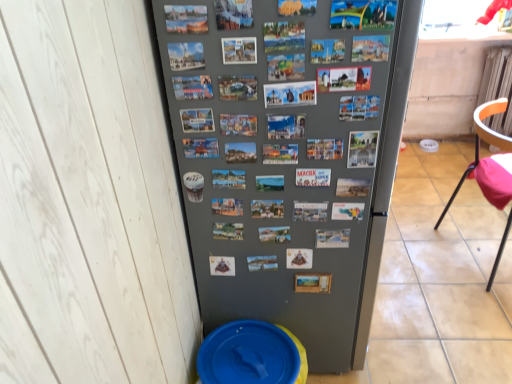
In order to click on orange plastic chair at right in this screenshot , I will do `click(485, 141)`.

Where is `gray matte refrigerator at center`? This screenshot has height=384, width=512. gray matte refrigerator at center is located at coordinates (289, 157).

Is orange plastic chair at right placed right next to blue plastic potty at lower left?

orange plastic chair at right is not next to blue plastic potty at lower left, and they're not touching.

From a real-world perspective, which is physically above, orange plastic chair at right or blue plastic potty at lower left?

orange plastic chair at right.

Where is `chair on the right of blue plastic potty at lower left`? chair on the right of blue plastic potty at lower left is located at coordinates pyautogui.click(x=485, y=141).

From the image's perspective, is orange plastic chair at right located above blue plastic potty at lower left?

Yes, from the image's perspective, orange plastic chair at right is over blue plastic potty at lower left.

Which is less distant, (246, 163) or (252, 336)?

Point (246, 163) is positioned closer to the camera compared to point (252, 336).

Is gray matte refrigerator at center closer to the viewer compared to blue plastic potty at lower left?

Yes, gray matte refrigerator at center is closer to the camera.

From the image's perspective, which is above, gray matte refrigerator at center or blue plastic potty at lower left?

gray matte refrigerator at center is shown above in the image.

Is gray matte refrigerator at center to the right of blue plastic potty at lower left from the viewer's perspective?

Yes.

Considering the positions of objects gray matte refrigerator at center and orange plastic chair at right in the image provided, who is more to the left, gray matte refrigerator at center or orange plastic chair at right?

From the viewer's perspective, gray matte refrigerator at center appears more on the left side.

From a real-world perspective, is gray matte refrigerator at center physically below orange plastic chair at right?

No, from a real-world perspective, gray matte refrigerator at center is not under orange plastic chair at right.

The height and width of the screenshot is (384, 512). I want to click on chair on the right of gray matte refrigerator at center, so click(x=485, y=141).

From the picture: Which is nearer, (212,380) or (495,103)?

Clearly, point (212,380) is closer to the camera than point (495,103).

Is blue plastic potty at lower left not within orange plastic chair at right?

Indeed, blue plastic potty at lower left is completely outside orange plastic chair at right.

In the scene shown: Which object is further away from the camera taking this photo, blue plastic potty at lower left or orange plastic chair at right?

orange plastic chair at right is behind.

Between blue plastic potty at lower left and gray matte refrigerator at center, which one has more height?

With more height is gray matte refrigerator at center.

Is blue plastic potty at lower left not near gray matte refrigerator at center?

They are positioned close to each other.

From a real-world perspective, is blue plastic potty at lower left located higher than gray matte refrigerator at center?

Actually, blue plastic potty at lower left is physically below gray matte refrigerator at center in the real world.

Based on the photo, is gray matte refrigerator at center surrounded by blue plastic potty at lower left?

No, gray matte refrigerator at center is not inside blue plastic potty at lower left.

Considering the points (493, 136) and (192, 108), which point is in front, point (493, 136) or point (192, 108)?

The point (192, 108) is closer to the camera.

Between orange plastic chair at right and gray matte refrigerator at center, which one has less height?

Standing shorter between the two is orange plastic chair at right.

From a real-world perspective, is orange plastic chair at right over gray matte refrigerator at center?

No.

Is orange plastic chair at right facing away from gray matte refrigerator at center?

Correct, orange plastic chair at right is looking away from gray matte refrigerator at center.

The height and width of the screenshot is (384, 512). I want to click on chair above the blue plastic potty at lower left (from a real-world perspective), so click(x=485, y=141).

Identify the location of refrigerator that is above the blue plastic potty at lower left (from the image's perspective). (289, 157).

Considering their positions, is orange plastic chair at right positioned further to blue plastic potty at lower left than gray matte refrigerator at center?

orange plastic chair at right is further to blue plastic potty at lower left.

Looking at the image, which one is located closer to gray matte refrigerator at center, blue plastic potty at lower left or orange plastic chair at right?

Among the two, blue plastic potty at lower left is located nearer to gray matte refrigerator at center.

In the scene shown: When comparing their distances from gray matte refrigerator at center, does orange plastic chair at right or blue plastic potty at lower left seem closer?

blue plastic potty at lower left.

Looking at the image, which one is located closer to orange plastic chair at right, gray matte refrigerator at center or blue plastic potty at lower left?

gray matte refrigerator at center is positioned closer to the anchor orange plastic chair at right.

Based on their spatial positions, is blue plastic potty at lower left or gray matte refrigerator at center closer to orange plastic chair at right?

gray matte refrigerator at center.

From the picture: When comparing their distances from blue plastic potty at lower left, does gray matte refrigerator at center or orange plastic chair at right seem closer?

The object closer to blue plastic potty at lower left is gray matte refrigerator at center.

Identify the location of refrigerator between blue plastic potty at lower left and orange plastic chair at right. Image resolution: width=512 pixels, height=384 pixels. (289, 157).